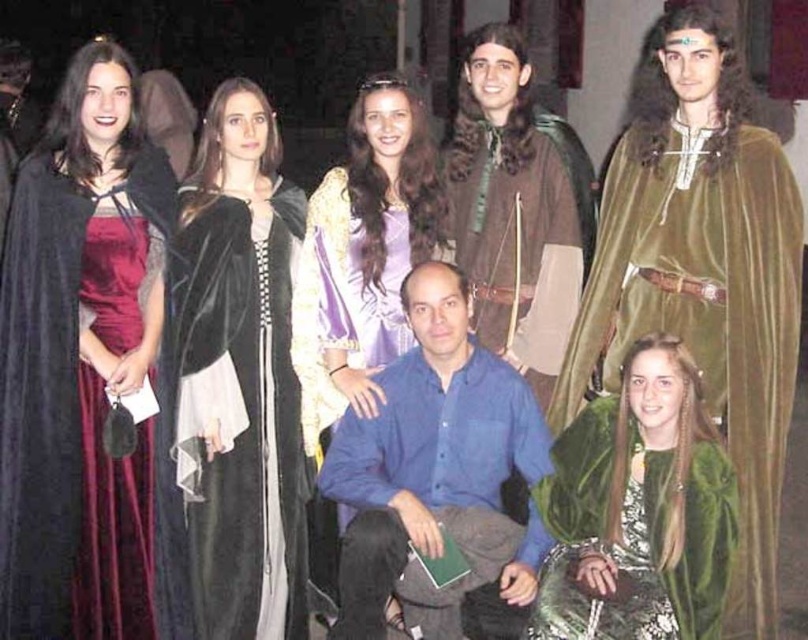
Who is more distant from viewer, (743, 253) or (546, 364)?

Positioned behind is point (546, 364).

Which is behind, point (772, 150) or point (465, 156)?

The point (465, 156) is more distant.

The height and width of the screenshot is (640, 808). Identify the location of velvet green cape at upper right. (705, 312).

Is velvet black dress at center shorter than green velvet cape at lower right?

No.

Between velvet black dress at center and green velvet cape at lower right, which one appears on the right side from the viewer's perspective?

Positioned to the right is green velvet cape at lower right.

Which is behind, point (291, 426) or point (680, 564)?

Positioned behind is point (291, 426).

Find the location of `velvet black dress at center`. velvet black dress at center is located at coordinates (238, 376).

Is point (86, 532) positioned before point (499, 348)?

Yes, point (86, 532) is closer to viewer.

Does velvet maroon dress at left have a greater height compared to brown leather jacket at center?

Indeed, velvet maroon dress at left has a greater height compared to brown leather jacket at center.

Who is more forward, (141, 522) or (567, 198)?

Positioned in front is point (141, 522).

The image size is (808, 640). What are the coordinates of `velvet maroon dress at left` in the screenshot? It's located at (80, 360).